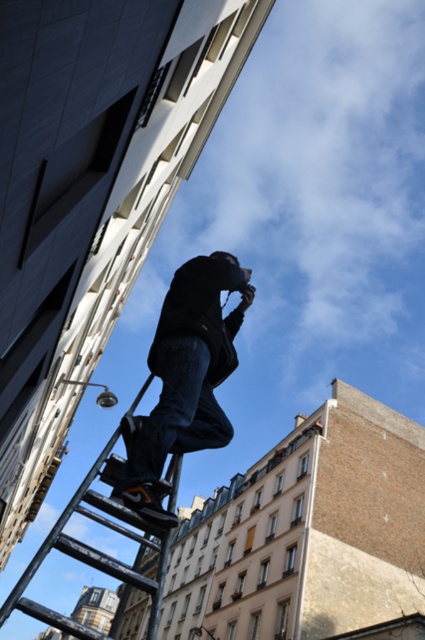
Does denim jeans at center appear under metallic black ladder at lower center?

Incorrect, denim jeans at center is not positioned below metallic black ladder at lower center.

Who is positioned more to the right, denim jeans at center or metallic black ladder at lower center?

Positioned to the right is denim jeans at center.

Who is more forward, (212, 305) or (161, 572)?

Point (161, 572) is more forward.

Where is `denim jeans at center`? The image size is (425, 640). denim jeans at center is located at coordinates (184, 378).